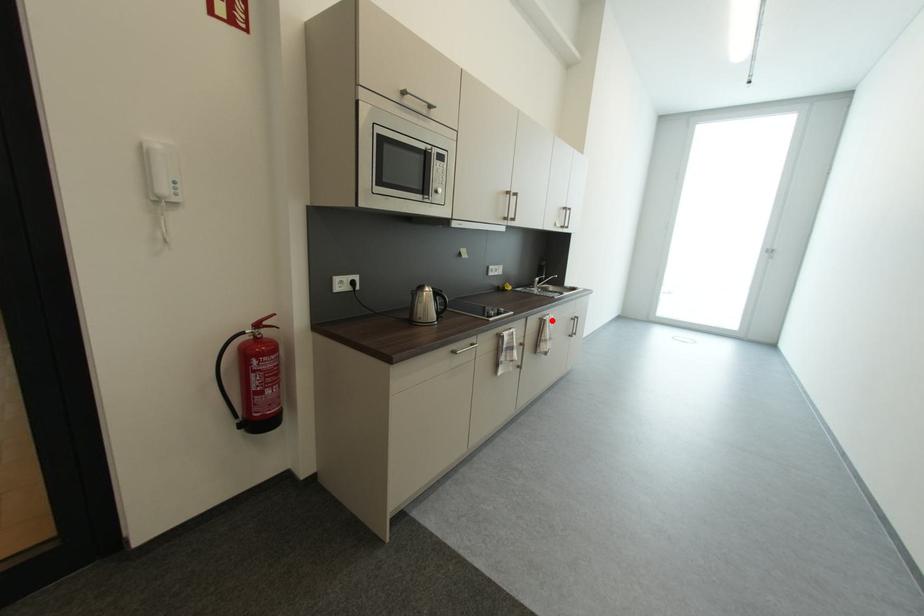
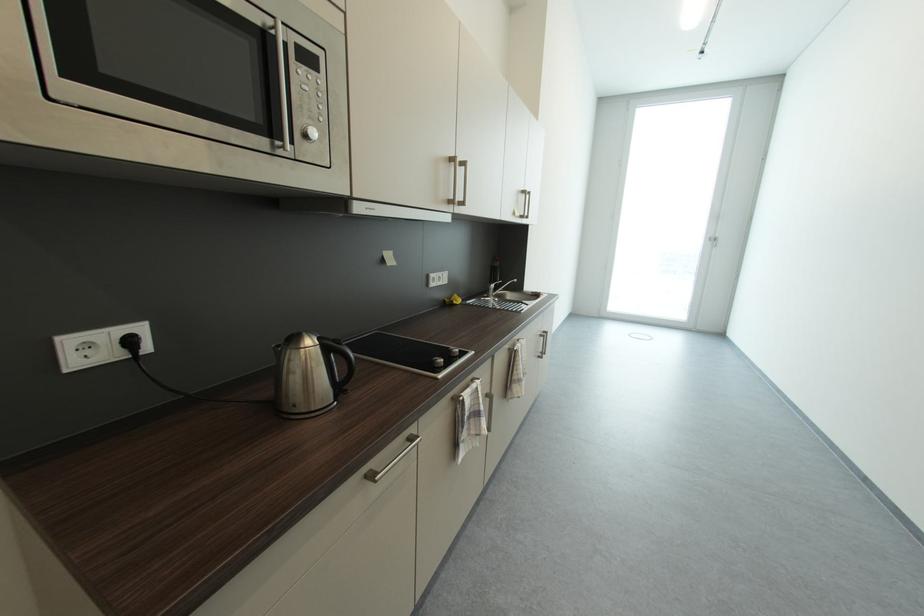
The point at the highlighted location is marked in the first image. Where is the corresponding point in the second image?

(523, 351)